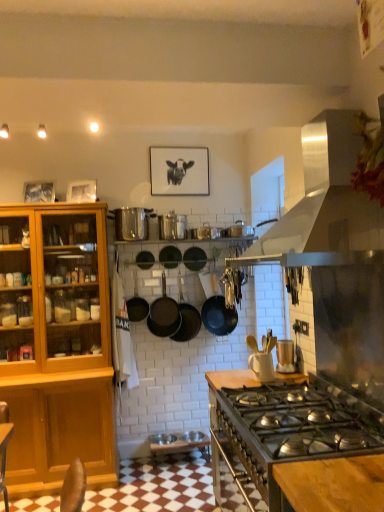
Question: From a real-world perspective, is metallic silver pot at center, the third appliance from the front, on metallic silver toaster at upper right, arranged as the first appliance when ordered from the bottom?

Choices:
 (A) yes
 (B) no

Answer: (A)

Question: From a real-world perspective, is metallic silver pot at center, which is the second appliance in left-to-right order, located beneath metallic silver toaster at upper right, positioned as the 4th appliance in top-to-bottom order?

Choices:
 (A) yes
 (B) no

Answer: (B)

Question: Is metallic silver pot at center, which is the 3th appliance in right-to-left order, further to camera compared to metallic silver toaster at upper right, the fourth appliance in the left-to-right sequence?

Choices:
 (A) yes
 (B) no

Answer: (A)

Question: Is metallic silver pot at center, the third appliance from the front, bigger than metallic silver toaster at upper right, the 1th appliance when ordered from front to back?

Choices:
 (A) no
 (B) yes

Answer: (B)

Question: Is metallic silver toaster at upper right, which ranks as the 1th appliance in right-to-left order, surrounded by metallic silver pot at center, which is the 3th appliance in right-to-left order?

Choices:
 (A) no
 (B) yes

Answer: (A)

Question: Is wooden cutting board at center wider or thinner than black matte wok at center, which is the first wok from right to left?

Choices:
 (A) wide
 (B) thin

Answer: (A)

Question: Is wooden cutting board at center in front of or behind black matte wok at center, the second wok viewed from the left, in the image?

Choices:
 (A) behind
 (B) front

Answer: (B)

Question: Is wooden cutting board at center taller or shorter than black matte wok at center, which is the first wok from right to left?

Choices:
 (A) short
 (B) tall

Answer: (B)

Question: Is point (370, 433) closer or farther from the camera than point (182, 309)?

Choices:
 (A) farther
 (B) closer

Answer: (B)

Question: From a real-world perspective, is stainless steel range hood at upper right physically located above or below black matte frying pan at center, which ranks as the 3th frying pan in left-to-right order?

Choices:
 (A) above
 (B) below

Answer: (A)

Question: Does point pyautogui.click(x=311, y=124) appear closer or farther from the camera than point pyautogui.click(x=205, y=305)?

Choices:
 (A) closer
 (B) farther

Answer: (A)

Question: Is stainless steel range hood at upper right taller or shorter than black matte frying pan at center, which ranks as the 3th frying pan in left-to-right order?

Choices:
 (A) short
 (B) tall

Answer: (B)

Question: Considering their positions, is stainless steel range hood at upper right located in front of or behind black matte frying pan at center, which ranks as the 3th frying pan in left-to-right order?

Choices:
 (A) front
 (B) behind

Answer: (A)

Question: In terms of size, does black matte picture frame at upper center appear bigger or smaller than black matte wok at center, the second wok positioned from the right?

Choices:
 (A) small
 (B) big

Answer: (A)

Question: From a real-world perspective, is black matte picture frame at upper center physically located above or below black matte wok at center, the second wok positioned from the right?

Choices:
 (A) above
 (B) below

Answer: (A)